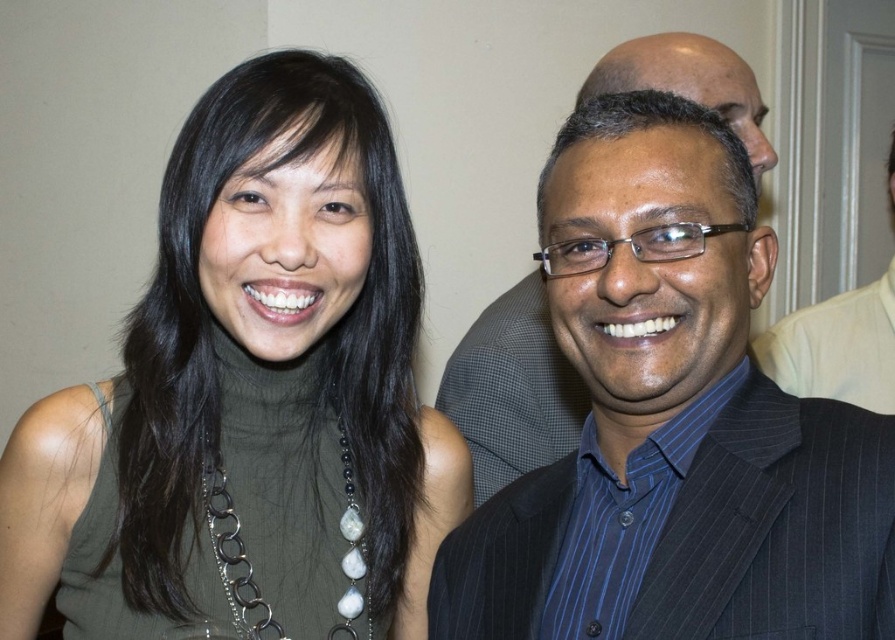
Question: Based on their relative distances, which object is farther from the black pinstripe suit at center?

Choices:
 (A) silver metallic chain with beads at center
 (B) green matte turtleneck at upper left

Answer: (A)

Question: Is green matte turtleneck at upper left below matte black suit at right?

Choices:
 (A) no
 (B) yes

Answer: (B)

Question: Does black pinstripe suit at center have a greater width compared to silver metallic chain with beads at center?

Choices:
 (A) yes
 (B) no

Answer: (A)

Question: Which object is the closest to the matte black suit at right?

Choices:
 (A) silver metallic chain with beads at center
 (B) green matte turtleneck at upper left

Answer: (B)

Question: Is black pinstripe suit at center smaller than matte black suit at right?

Choices:
 (A) no
 (B) yes

Answer: (A)

Question: Which point is farther from the camera taking this photo?

Choices:
 (A) (431, 493)
 (B) (774, 344)
 (C) (611, 83)
 (D) (359, 516)

Answer: (B)